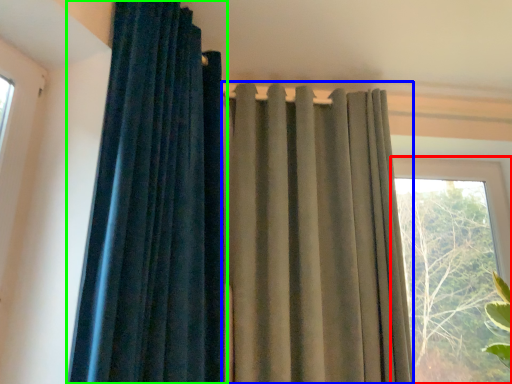
Question: Which is farther away from window (highlighted by a red box)? curtain (highlighted by a blue box) or curtain (highlighted by a green box)?

Choices:
 (A) curtain
 (B) curtain

Answer: (B)